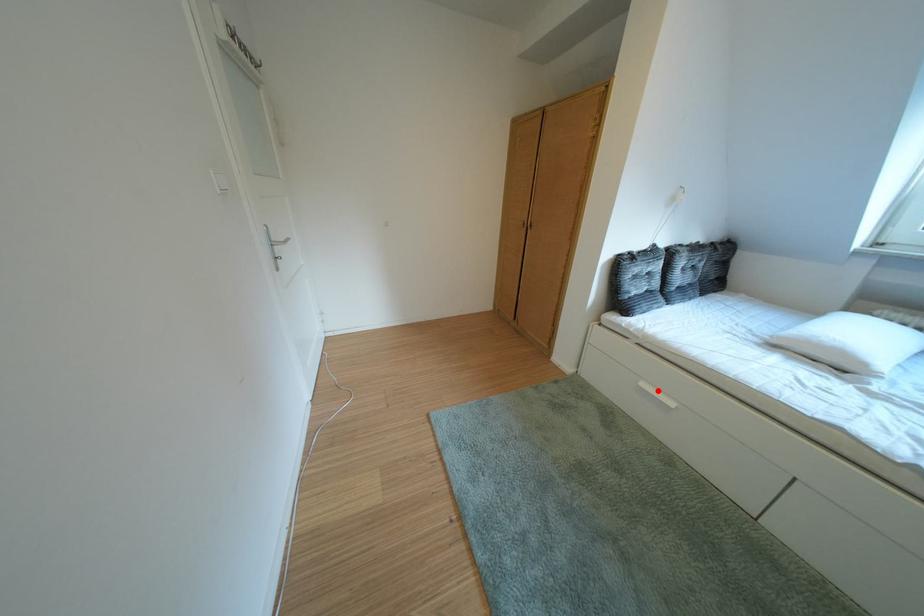
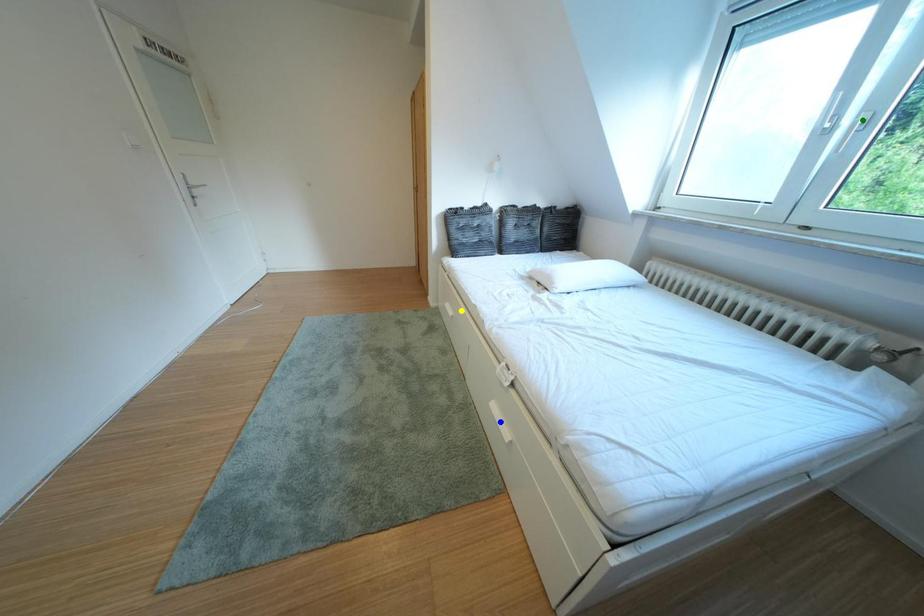
Question: I am providing you with two images of the same scene from different viewpoints. A red point is marked on the first image. You are given multiple points on the second image. Which point in image 2 is actually the same real-world point as the red point in image 1?

Choices:
 (A) yellow point
 (B) green point
 (C) blue point

Answer: (A)